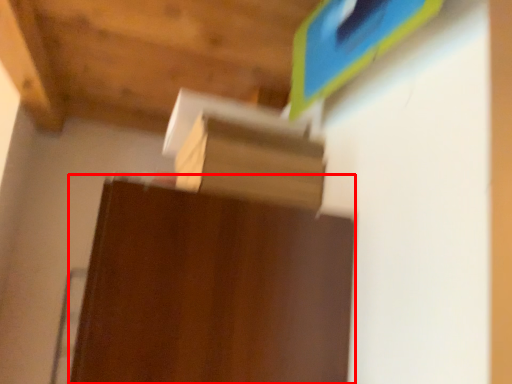
Question: From the image's perspective, where is furniture (annotated by the red box) located relative to cardboard box?

Choices:
 (A) above
 (B) below

Answer: (B)